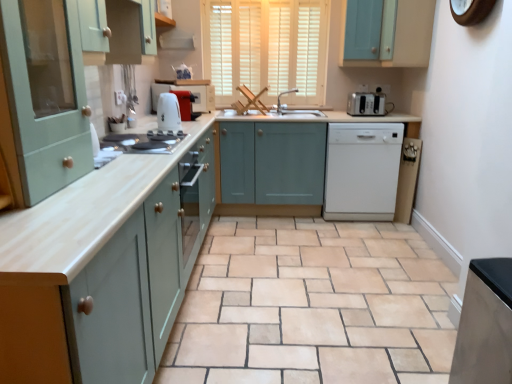
Question: Considering the relative sizes of matte white toaster at center, which is counted as the first home appliance, starting from the left, and satin silver fridge at lower right, acting as the 2th home appliance starting from the left, in the image provided, is matte white toaster at center, which is counted as the first home appliance, starting from the left, smaller than satin silver fridge at lower right, acting as the 2th home appliance starting from the left,?

Choices:
 (A) yes
 (B) no

Answer: (A)

Question: Considering the relative sizes of matte white toaster at center, the 3th home appliance in the front-to-back sequence, and satin silver fridge at lower right, acting as the 3th home appliance starting from the right, in the image provided, is matte white toaster at center, the 3th home appliance in the front-to-back sequence, taller than satin silver fridge at lower right, acting as the 3th home appliance starting from the right,?

Choices:
 (A) no
 (B) yes

Answer: (A)

Question: Does matte white toaster at center, which is counted as the first home appliance, starting from the left, have a lesser width compared to satin silver fridge at lower right, acting as the 2th home appliance starting from the left?

Choices:
 (A) no
 (B) yes

Answer: (B)

Question: Would you say matte white toaster at center, the 3th home appliance in the front-to-back sequence, is a long distance from satin silver fridge at lower right, acting as the 3th home appliance starting from the right?

Choices:
 (A) no
 (B) yes

Answer: (B)

Question: From the image's perspective, is matte white toaster at center, the 3th home appliance in the front-to-back sequence, beneath satin silver fridge at lower right, which is counted as the fourth home appliance, starting from the back?

Choices:
 (A) yes
 (B) no

Answer: (B)

Question: Is matte white toaster at center, which is counted as the first home appliance, starting from the left, aimed at satin silver fridge at lower right, the 1th home appliance when ordered from front to back?

Choices:
 (A) no
 (B) yes

Answer: (B)

Question: Does white matte dishwasher at center, which is the 3th home appliance from back to front, have a lesser width compared to matte wood countertop at center?

Choices:
 (A) yes
 (B) no

Answer: (A)

Question: Does white matte dishwasher at center, the second home appliance when ordered from right to left, have a lesser height compared to matte wood countertop at center?

Choices:
 (A) no
 (B) yes

Answer: (B)

Question: From the image's perspective, is white matte dishwasher at center, the 3th home appliance when ordered from left to right, below matte wood countertop at center?

Choices:
 (A) yes
 (B) no

Answer: (B)

Question: Is matte wood countertop at center a part of white matte dishwasher at center, marked as the second home appliance in a front-to-back arrangement?

Choices:
 (A) no
 (B) yes

Answer: (A)

Question: Can we say white matte dishwasher at center, marked as the second home appliance in a front-to-back arrangement, lies outside matte wood countertop at center?

Choices:
 (A) no
 (B) yes

Answer: (B)

Question: Is the surface of white matte dishwasher at center, the 3th home appliance when ordered from left to right, in direct contact with matte wood countertop at center?

Choices:
 (A) no
 (B) yes

Answer: (A)

Question: Could you tell me if matte wood countertop at center is facing matte white toaster at center, which is counted as the first home appliance, starting from the left?

Choices:
 (A) no
 (B) yes

Answer: (A)